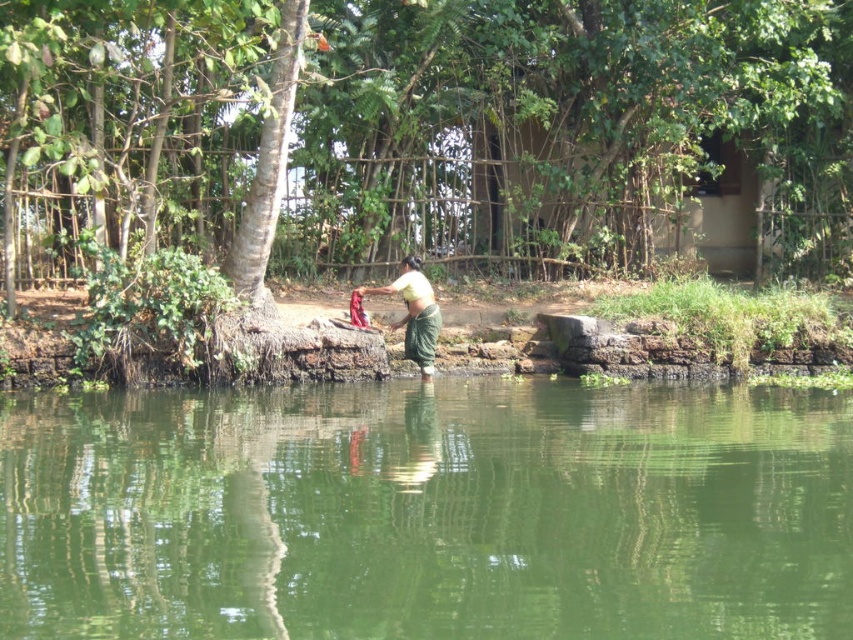
You are standing on the path near the water and want to wash your hands. Which object, the green smooth water at center or the green leafy tree at center, is closer to you?

The green smooth water at center is closer to you because it is positioned to the left of the green leafy tree at center, meaning it is nearer in the scene.

You are a photographer trying to capture the reflection of the green leafy tree at center in the water. Based on the scene, where should you position yourself to ensure the reflection is clearly visible?

To capture the reflection of the green leafy tree at center, position yourself at the water level directly in front of the tree at point (407,115). This ensures the reflection is clearly visible in the calm, reflective water.